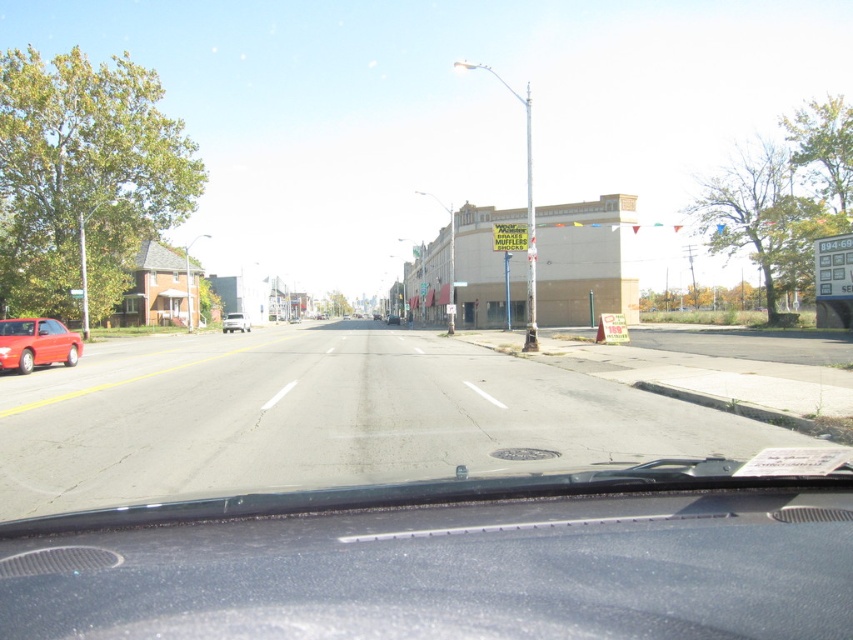
Can you confirm if black glossy dashboard at center is positioned below matte red car at center?

Indeed, black glossy dashboard at center is positioned under matte red car at center.

I want to click on black glossy dashboard at center, so click(x=448, y=561).

Is black glossy dashboard at center shorter than matte red car at left?

Yes, black glossy dashboard at center is shorter than matte red car at left.

This screenshot has width=853, height=640. Find the location of `black glossy dashboard at center`. black glossy dashboard at center is located at coordinates (448, 561).

You are a GUI agent. You are given a task and a screenshot of the screen. Output one action in this format:
    pyautogui.click(x=<x>, y=<y>)
    Task: Click on the black glossy dashboard at center
    Image resolution: width=853 pixels, height=640 pixels.
    Given the screenshot: What is the action you would take?
    pyautogui.click(x=448, y=561)

Who is positioned more to the right, matte red car at center or metallic silver sedan at center?

From the viewer's perspective, metallic silver sedan at center appears more on the right side.

Which is below, matte red car at center or metallic silver sedan at center?

metallic silver sedan at center is below.

Which is behind, point (224, 323) or point (389, 316)?

The point (389, 316) is more distant.

Identify the location of matte red car at center. (235, 323).